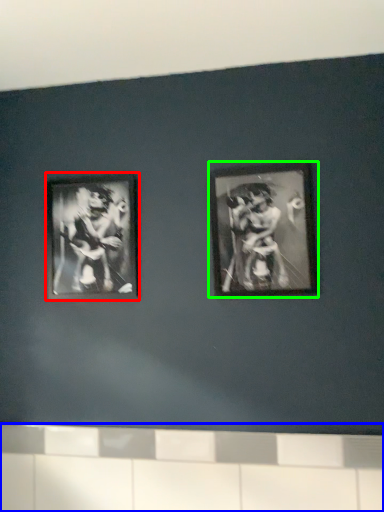
Question: Estimate the real-world distances between objects in this image. Which object is closer to picture frame (highlighted by a red box), ledge (highlighted by a blue box) or picture frame (highlighted by a green box)?

Choices:
 (A) ledge
 (B) picture frame

Answer: (B)